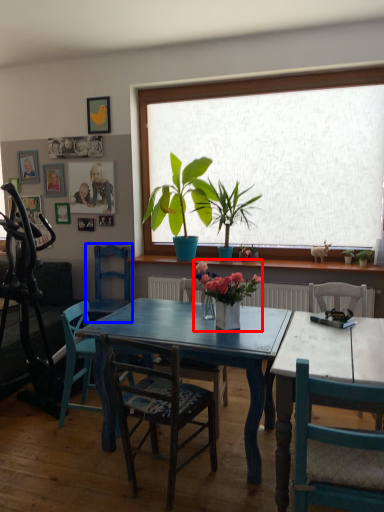
Question: Which point is further to the camera, houseplant (highlighted by a red box) or chair (highlighted by a blue box)?

Choices:
 (A) houseplant
 (B) chair

Answer: (B)